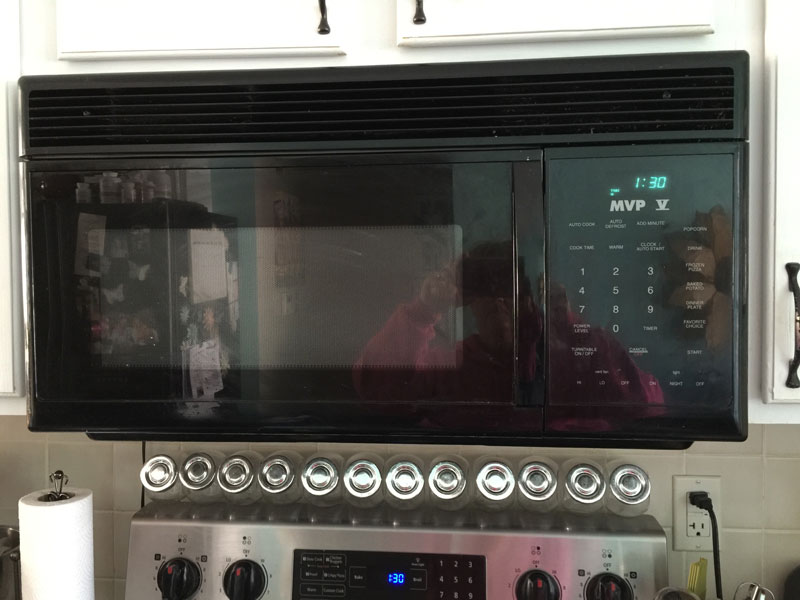
This screenshot has width=800, height=600. I want to click on burner knobs, so click(x=234, y=578), click(x=194, y=577), click(x=549, y=581).